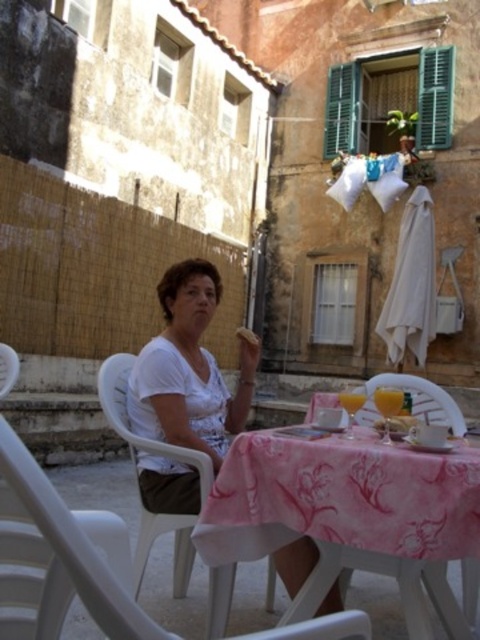
Based on the photo, you are a waiter at a cafe and need to deliver a dessert to the table where the white matte shirt at center and the translucent glass juice at table center are located. To place the dessert on the table without spilling the juice, where should you place it?

The white matte shirt at center is located above the translucent glass juice at table center, so you should place the dessert on the table away from the translucent glass juice at table center to avoid knocking it over.

You are taking a photo of the scene and want to focus on both the point at (443, 506) and the point at (387, 422). Which point should you focus on first to ensure both are in sharp focus?

You should focus on point (443, 506) first because it is closer to the camera than point (387, 422). By focusing on the closer point, the farther point will also be within the depth of field and appear sharp.